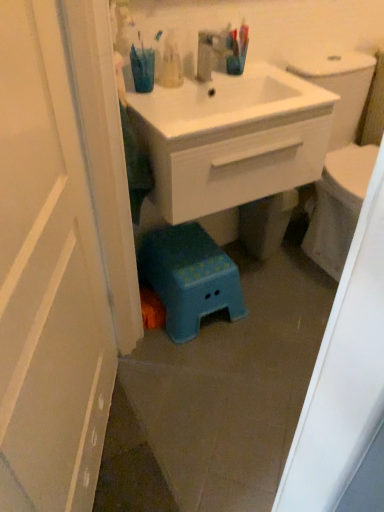
Find the location of a particular element. The width and height of the screenshot is (384, 512). free spot in front of blue plastic step stool at lower center is located at coordinates (214, 365).